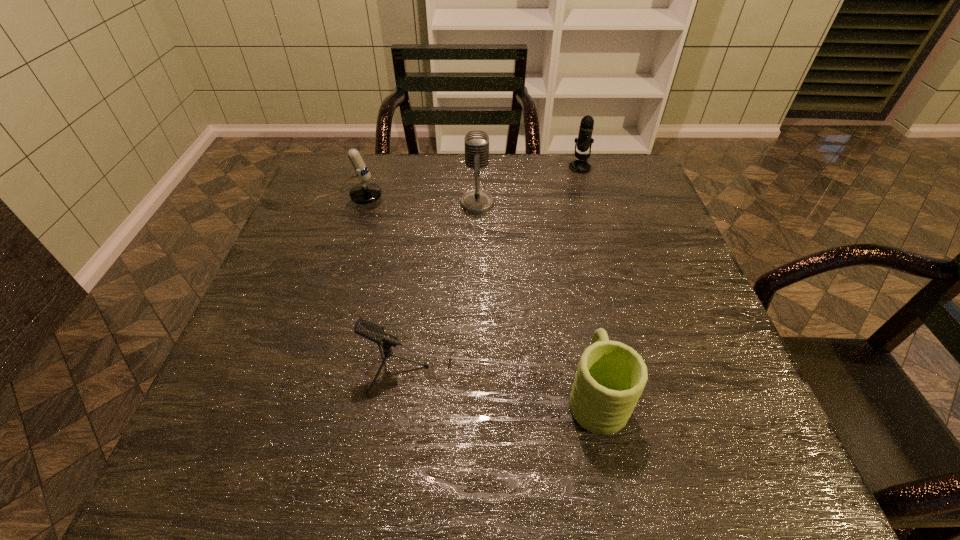
Identify the location of vacant area situated on the side of the mug with the handle. The image size is (960, 540). (582, 326).

At what (x,y) coordinates should I click in order to perform the action: click on vacant space situated 0.210m on the side of the mug with the handle. Please return your answer as a coordinate pair (x, y). Looking at the image, I should click on (573, 280).

Identify the location of vacant area situated on the side of the mug with the handle. (563, 228).

This screenshot has width=960, height=540. What are the coordinates of `object that is at the near edge` in the screenshot? It's located at (611, 376).

This screenshot has height=540, width=960. I want to click on object located in the left edge section of the desktop, so click(x=366, y=192).

Locate an element on the screen. The image size is (960, 540). object present at the right edge is located at coordinates (584, 141).

Where is `object positioned at the far left corner`? object positioned at the far left corner is located at coordinates (366, 192).

Locate an element on the screen. This screenshot has width=960, height=540. object positioned at the far right corner is located at coordinates (584, 141).

Find the location of a particular element. This screenshot has width=960, height=540. vacant space at the far edge is located at coordinates (404, 183).

You are a GUI agent. You are given a task and a screenshot of the screen. Output one action in this format:
    pyautogui.click(x=<x>, y=<y>)
    Task: Click on the free space at the near edge of the desktop
    This screenshot has height=540, width=960.
    Given the screenshot: What is the action you would take?
    pyautogui.click(x=372, y=469)